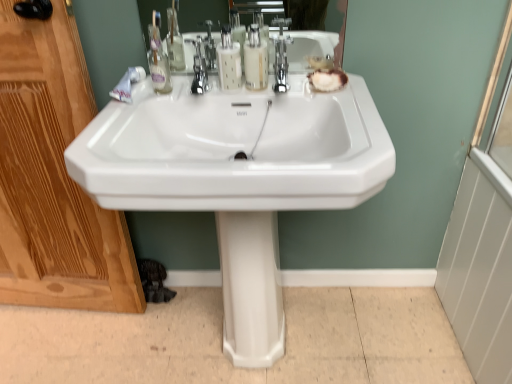
Where is `empty space that is in between wooden screen door at left and white glossy pedestal at center`? The image size is (512, 384). empty space that is in between wooden screen door at left and white glossy pedestal at center is located at coordinates (157, 333).